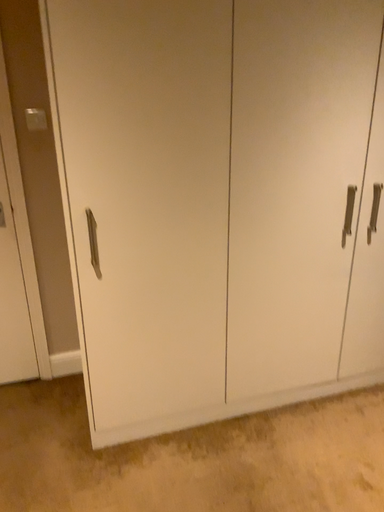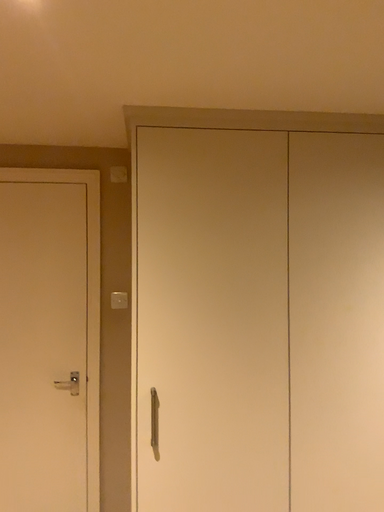
Question: How did the camera likely rotate when shooting the video?

Choices:
 (A) rotated upward
 (B) rotated downward

Answer: (A)